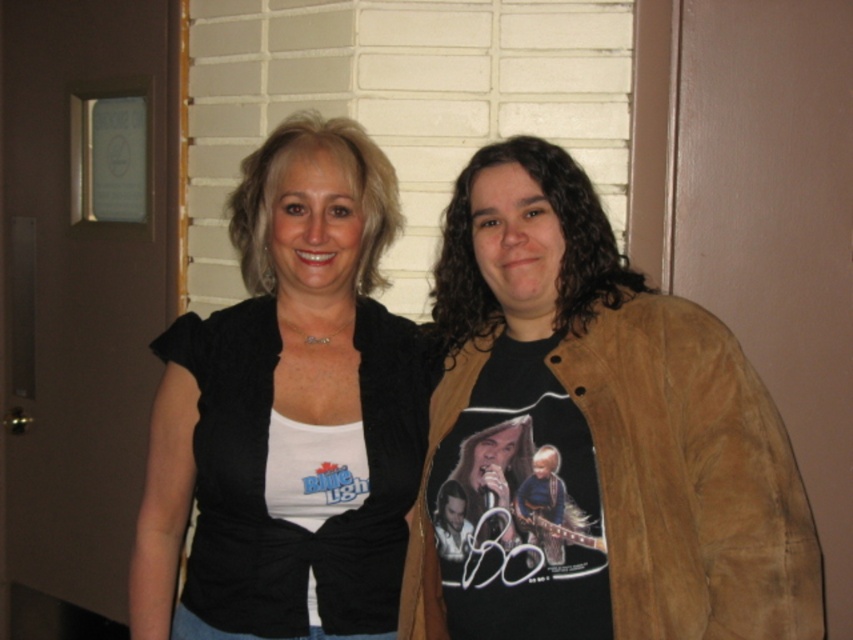
Who is lower down, suede jacket at right or matte black shirt at center?

suede jacket at right is below.

Who is shorter, suede jacket at right or matte black shirt at center?

With less height is suede jacket at right.

Locate an element on the screen. suede jacket at right is located at coordinates (592, 440).